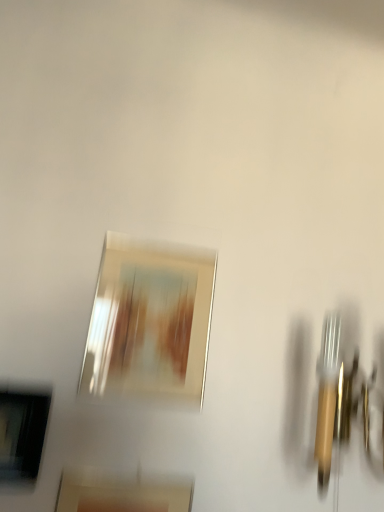
Question: Considering the relative positions of matte black picture frame at lower left, the 2th picture frame positioned from the bottom, and metallic silver picture frame at center, the 1th picture frame in the top-to-bottom sequence, in the image provided, is matte black picture frame at lower left, the 2th picture frame positioned from the bottom, to the left of metallic silver picture frame at center, the 1th picture frame in the top-to-bottom sequence, from the viewer's perspective?

Choices:
 (A) yes
 (B) no

Answer: (A)

Question: Is metallic silver picture frame at center, which is counted as the 3th picture frame, starting from the bottom, surrounded by matte black picture frame at lower left, the 2th picture frame positioned from the bottom?

Choices:
 (A) no
 (B) yes

Answer: (A)

Question: Does matte black picture frame at lower left, marked as the second picture frame in a top-to-bottom arrangement, lie behind metallic silver picture frame at center, which is counted as the 3th picture frame, starting from the bottom?

Choices:
 (A) yes
 (B) no

Answer: (B)

Question: From a real-world perspective, is matte black picture frame at lower left, marked as the second picture frame in a top-to-bottom arrangement, under metallic silver picture frame at center, which is counted as the 3th picture frame, starting from the bottom?

Choices:
 (A) no
 (B) yes

Answer: (B)

Question: Does matte black picture frame at lower left, the 2th picture frame positioned from the bottom, have a greater width compared to metallic silver picture frame at center, which is counted as the 3th picture frame, starting from the bottom?

Choices:
 (A) yes
 (B) no

Answer: (A)

Question: Visually, is metallic silver picture frame at center, which is counted as the 3th picture frame, starting from the bottom, positioned to the left or to the right of matte gold picture frame at center, positioned as the 1th picture frame in bottom-to-top order?

Choices:
 (A) right
 (B) left

Answer: (A)

Question: Is metallic silver picture frame at center, which is counted as the 3th picture frame, starting from the bottom, bigger or smaller than matte gold picture frame at center, which is counted as the 3th picture frame, starting from the top?

Choices:
 (A) big
 (B) small

Answer: (B)

Question: Is metallic silver picture frame at center, the 1th picture frame in the top-to-bottom sequence, spatially inside matte gold picture frame at center, positioned as the 1th picture frame in bottom-to-top order, or outside of it?

Choices:
 (A) outside
 (B) inside

Answer: (A)

Question: From a real-world perspective, is metallic silver picture frame at center, the 1th picture frame in the top-to-bottom sequence, above or below matte gold picture frame at center, which is counted as the 3th picture frame, starting from the top?

Choices:
 (A) above
 (B) below

Answer: (A)

Question: Is matte black picture frame at lower left, the 2th picture frame positioned from the bottom, spatially inside metallic silver picture frame at center, which is counted as the 3th picture frame, starting from the bottom, or outside of it?

Choices:
 (A) outside
 (B) inside

Answer: (A)

Question: Considering the positions of matte black picture frame at lower left, marked as the second picture frame in a top-to-bottom arrangement, and metallic silver picture frame at center, the 1th picture frame in the top-to-bottom sequence, in the image, is matte black picture frame at lower left, marked as the second picture frame in a top-to-bottom arrangement, taller or shorter than metallic silver picture frame at center, the 1th picture frame in the top-to-bottom sequence,?

Choices:
 (A) short
 (B) tall

Answer: (A)

Question: In terms of size, does matte black picture frame at lower left, the 2th picture frame positioned from the bottom, appear bigger or smaller than metallic silver picture frame at center, which is counted as the 3th picture frame, starting from the bottom?

Choices:
 (A) big
 (B) small

Answer: (B)

Question: Is matte black picture frame at lower left, the 2th picture frame positioned from the bottom, wider or thinner than metallic silver picture frame at center, the 1th picture frame in the top-to-bottom sequence?

Choices:
 (A) wide
 (B) thin

Answer: (A)

Question: Is matte black picture frame at lower left, the 2th picture frame positioned from the bottom, in front of or behind matte gold picture frame at center, which is counted as the 3th picture frame, starting from the top, in the image?

Choices:
 (A) behind
 (B) front

Answer: (A)

Question: Is point (3, 428) positioned closer to the camera than point (114, 504)?

Choices:
 (A) farther
 (B) closer

Answer: (B)